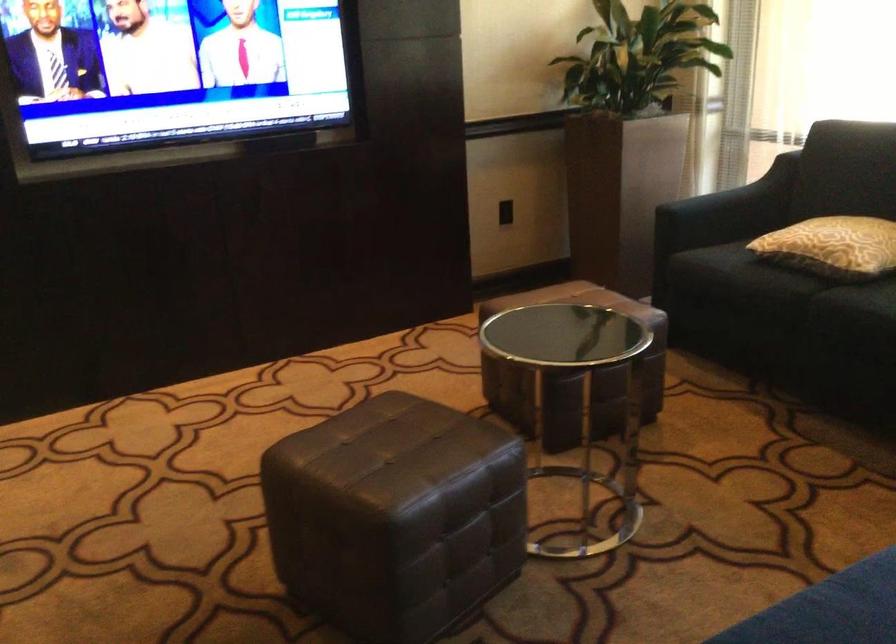
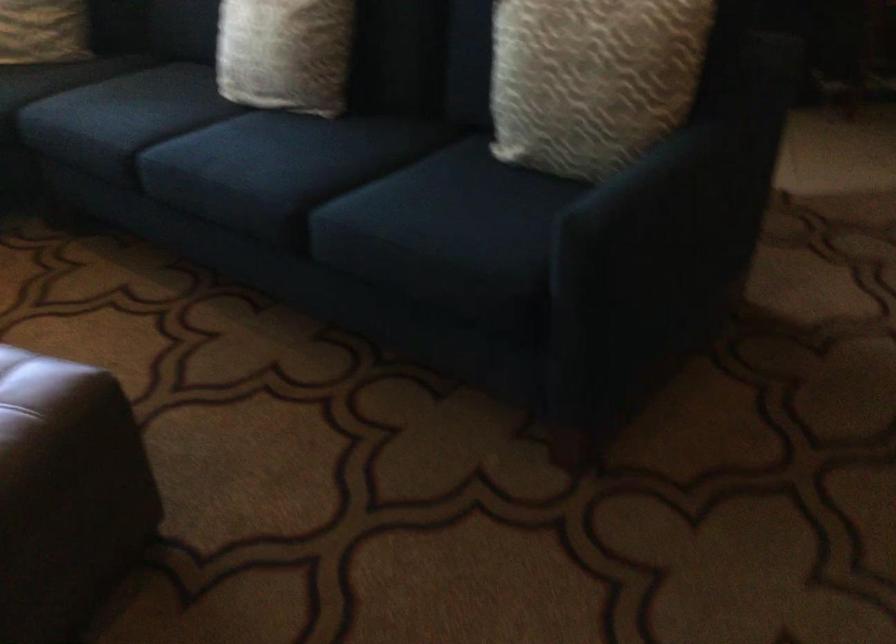
In the second image, find the point that corresponds to (394,516) in the first image.

(118, 357)